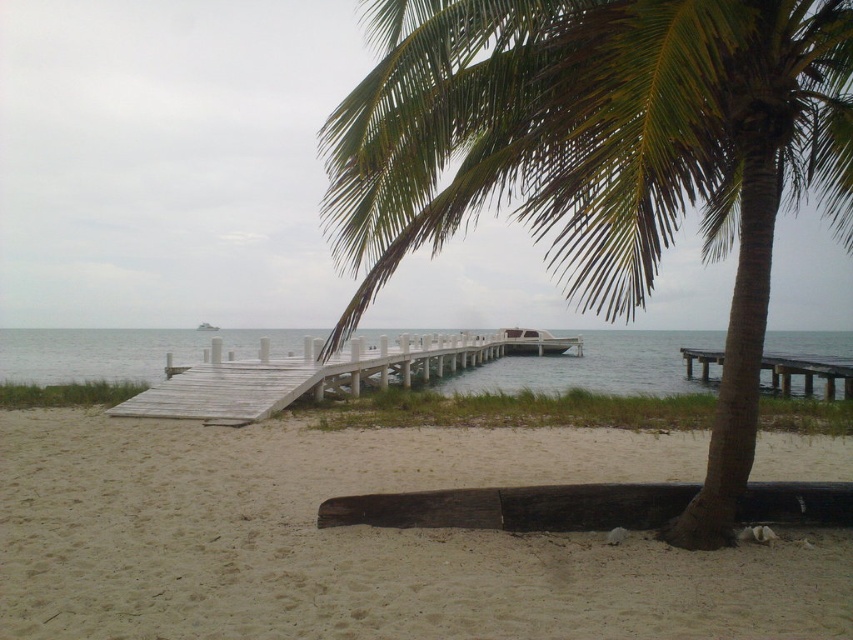
Question: Observing the image, what is the correct spatial positioning of green leafy palm tree at center in reference to wooden dock at right?

Choices:
 (A) below
 (B) above

Answer: (B)

Question: Which point appears closest to the camera in this image?

Choices:
 (A) (67, 337)
 (B) (386, 600)
 (C) (192, 397)

Answer: (B)

Question: Is clear blue water at center above white wooden dock at center?

Choices:
 (A) no
 (B) yes

Answer: (A)

Question: Can you confirm if white wooden dock at center is positioned below wooden dock at right?

Choices:
 (A) no
 (B) yes

Answer: (A)

Question: Among these objects, which one is farthest from the camera?

Choices:
 (A) clear blue water at center
 (B) sandy beach at lower left
 (C) wooden dock at right
 (D) green leafy palm tree at center

Answer: (A)

Question: Which object is farther from the camera taking this photo?

Choices:
 (A) clear blue water at center
 (B) white wooden dock at center
 (C) green leafy palm tree at center
 (D) wooden dock at right

Answer: (A)